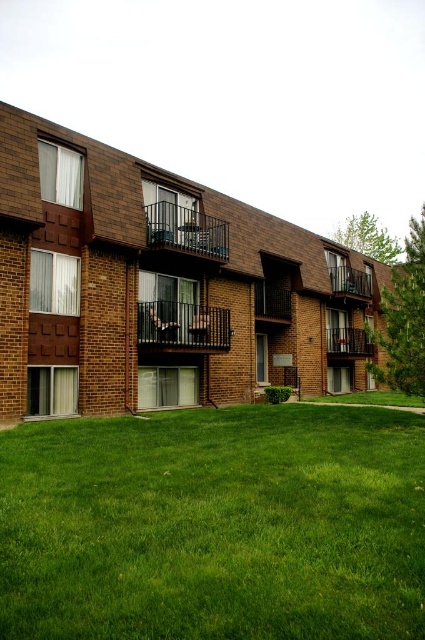
Question: Is green grass at lower center positioned at the back of brown wooden balcony at upper right?

Choices:
 (A) no
 (B) yes

Answer: (A)

Question: Is green grass at lower center above wooden balcony at center right?

Choices:
 (A) no
 (B) yes

Answer: (A)

Question: Which object appears closest to the camera in this image?

Choices:
 (A) wooden balcony at center right
 (B) brown wooden balcony at upper right

Answer: (B)

Question: Among these points, which one is farthest from the camera?

Choices:
 (A) (350, 353)
 (B) (337, 292)
 (C) (170, 240)
 (D) (385, 525)

Answer: (A)

Question: Is green grass at lower center smaller than black metal balcony at center?

Choices:
 (A) no
 (B) yes

Answer: (A)

Question: Which point appears farthest from the camera in this image?

Choices:
 (A) (340, 291)
 (B) (155, 589)

Answer: (A)